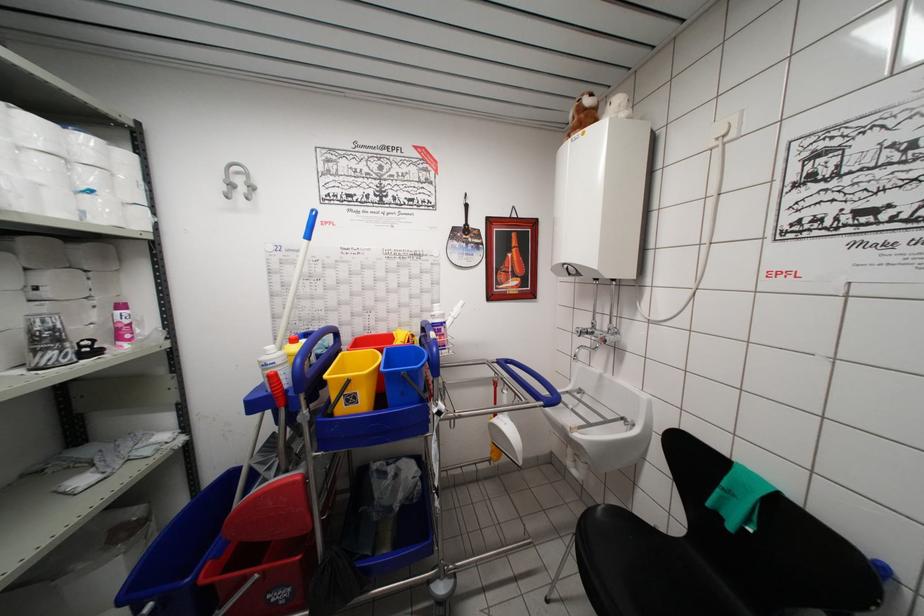
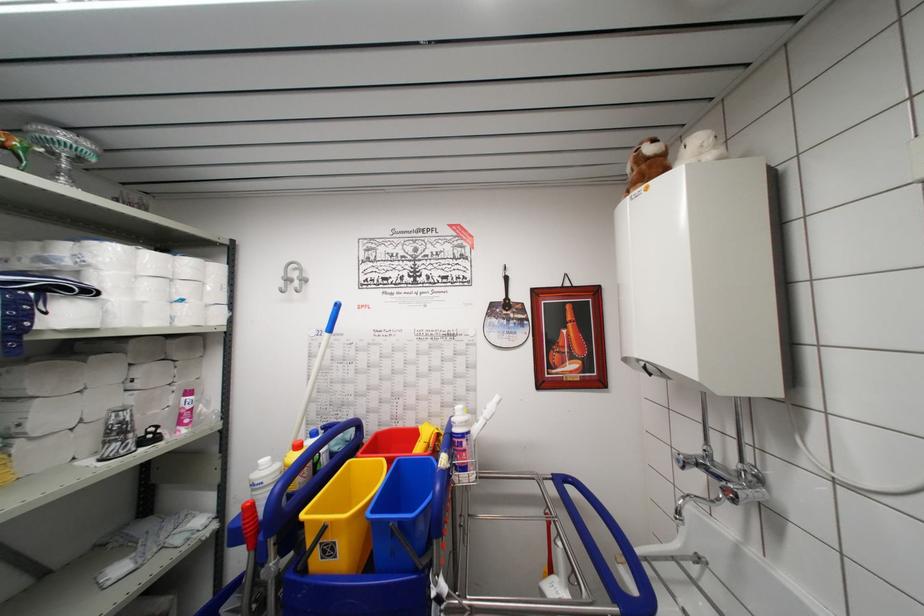
Find the pixel in the second image that matches (x=281, y=368) in the first image.

(269, 488)